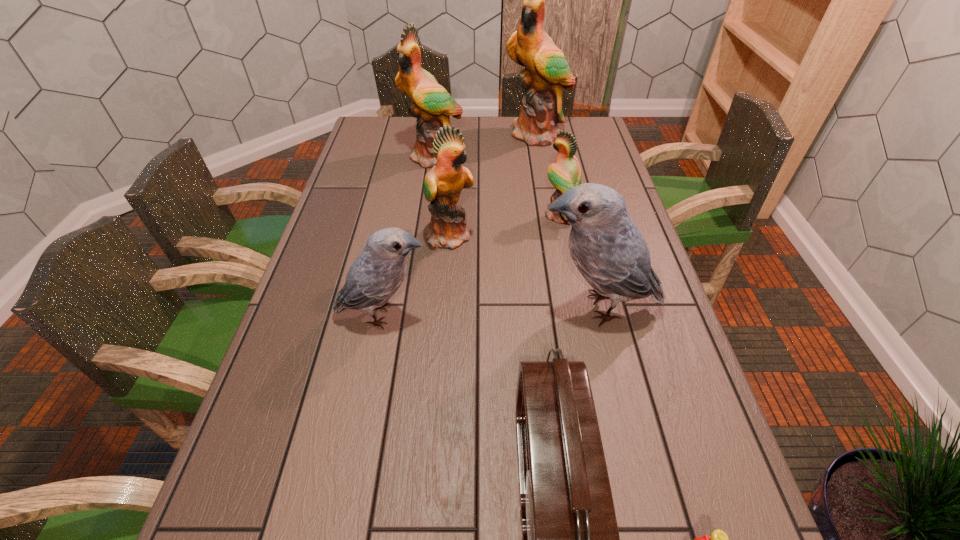
Locate an element on the screen. The image size is (960, 540). free spot located 0.240m on the front-facing side of the second smallest green parrot is located at coordinates (557, 235).

Image resolution: width=960 pixels, height=540 pixels. I want to click on vacant space located 0.120m on the front-facing side of the right gray parrot, so click(x=486, y=307).

You are a GUI agent. You are given a task and a screenshot of the screen. Output one action in this format:
    pyautogui.click(x=<x>, y=<y>)
    Task: Click on the free location located 0.100m on the front-facing side of the right gray parrot
    
    Given the screenshot: What is the action you would take?
    pyautogui.click(x=493, y=307)

You are a GUI agent. You are given a task and a screenshot of the screen. Output one action in this format:
    pyautogui.click(x=<x>, y=<y>)
    Task: Click on the vacant position located 0.340m on the front-facing side of the right gray parrot
    The height and width of the screenshot is (540, 960).
    Given the screenshot: What is the action you would take?
    pyautogui.click(x=397, y=307)

Locate an element on the screen. Image resolution: width=960 pixels, height=540 pixels. vacant area located on the front-facing side of the smallest green parrot is located at coordinates (488, 215).

Image resolution: width=960 pixels, height=540 pixels. What are the coordinates of `vacant space located 0.280m on the front-facing side of the smallest green parrot` in the screenshot? It's located at (452, 215).

Where is `vacant space located 0.120m on the front-facing side of the smallest green parrot`? vacant space located 0.120m on the front-facing side of the smallest green parrot is located at coordinates (504, 215).

Find the location of `vacant area located on the front-facing side of the smaller gray parrot`. vacant area located on the front-facing side of the smaller gray parrot is located at coordinates (574, 315).

Where is `object that is at the left edge`? The image size is (960, 540). object that is at the left edge is located at coordinates (374, 277).

Where is `object that is positioned at the far right corner`? The height and width of the screenshot is (540, 960). object that is positioned at the far right corner is located at coordinates (546, 71).